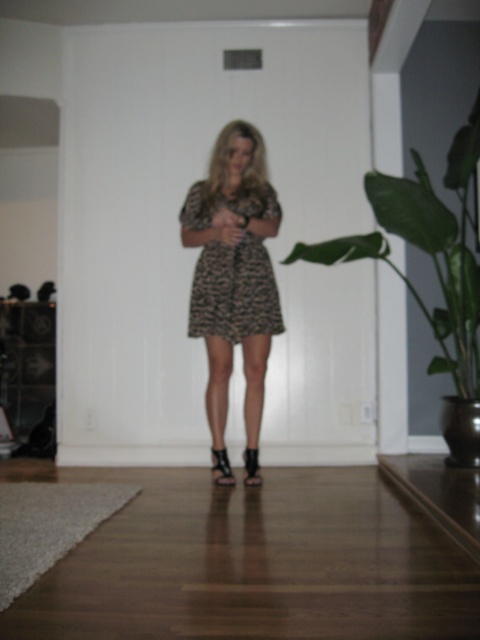
Question: Does green leafy plant at center right have a smaller size compared to leopard print fabric dress at center?

Choices:
 (A) yes
 (B) no

Answer: (B)

Question: Which of the following is the farthest from the observer?

Choices:
 (A) green leafy plant at center right
 (B) leopard print dress at center

Answer: (B)

Question: Among these objects, which one is farthest from the camera?

Choices:
 (A) green leafy plant at center right
 (B) leopard print dress at center

Answer: (B)

Question: Which of these objects is positioned farthest from the green leafy plant at center right?

Choices:
 (A) leopard print dress at center
 (B) leopard print fabric dress at center

Answer: (A)

Question: Observing the image, what is the correct spatial positioning of leopard print dress at center in reference to leopard print fabric dress at center?

Choices:
 (A) left
 (B) right

Answer: (A)

Question: Does leopard print dress at center have a greater width compared to green leafy plant at center right?

Choices:
 (A) no
 (B) yes

Answer: (A)